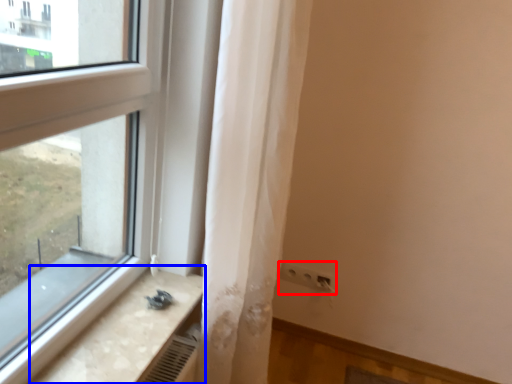
Question: Which object appears closest to the camera in this image, electric outlet (highlighted by a red box) or counter top (highlighted by a blue box)?

Choices:
 (A) electric outlet
 (B) counter top

Answer: (B)